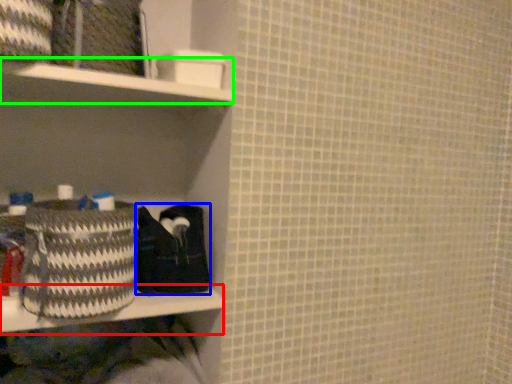
Question: Based on their relative distances, which object is nearer to ledge (highlighted by a red box)? Choose from material (highlighted by a blue box) and cabinet (highlighted by a green box).

Choices:
 (A) material
 (B) cabinet

Answer: (A)